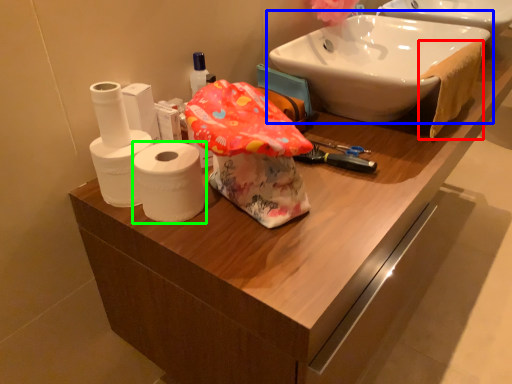
Question: Which is farther away from bath towel (highlighted by a red box)? sink (highlighted by a blue box) or toilet paper (highlighted by a green box)?

Choices:
 (A) sink
 (B) toilet paper

Answer: (B)